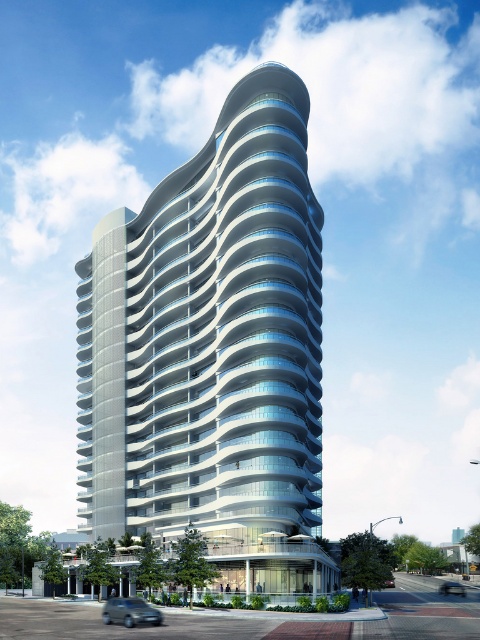
Does white glass building at center have a larger size compared to silver metallic car at lower right?

Correct, white glass building at center is larger in size than silver metallic car at lower right.

Can you confirm if white glass building at center is positioned to the left of silver metallic car at lower right?

Yes, white glass building at center is to the left of silver metallic car at lower right.

Identify the location of white glass building at center. (213, 353).

Between white glass building at center and silver metallic car at lower left, which one appears on the right side from the viewer's perspective?

Positioned to the right is white glass building at center.

Which of these two, white glass building at center or silver metallic car at lower left, stands taller?

white glass building at center is taller.

Consider the image. Who is more forward, (x=248, y=480) or (x=107, y=612)?

Point (x=107, y=612) is more forward.

The image size is (480, 640). In order to click on white glass building at center in this screenshot , I will do `click(213, 353)`.

Is silver metallic car at lower left further to camera compared to metallic silver car at lower center?

No, it is not.

How distant is silver metallic car at lower left from metallic silver car at lower center?

silver metallic car at lower left is 17.03 meters away from metallic silver car at lower center.

Does point (120, 596) come behind point (386, 579)?

Yes, it is.

This screenshot has height=640, width=480. In order to click on silver metallic car at lower left in this screenshot , I will do `click(130, 611)`.